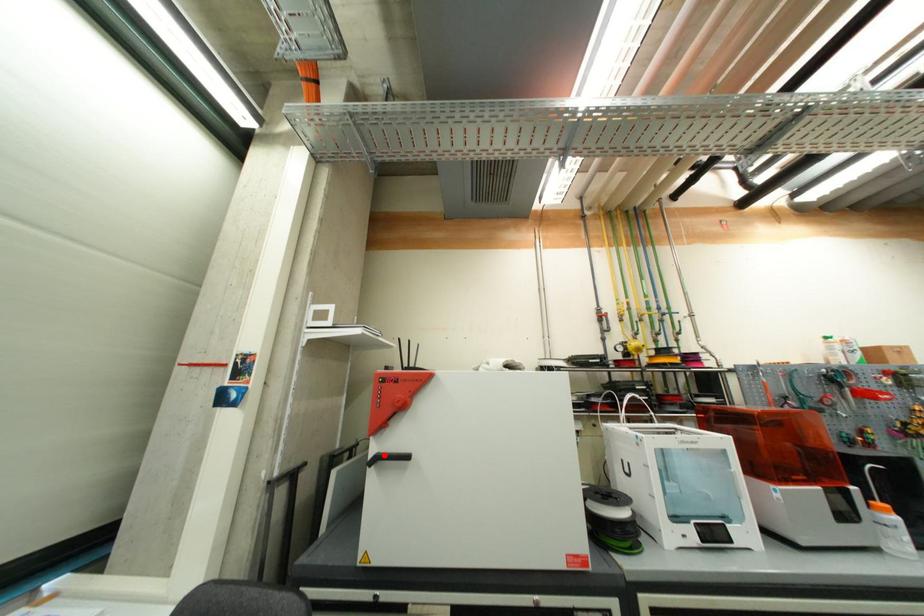
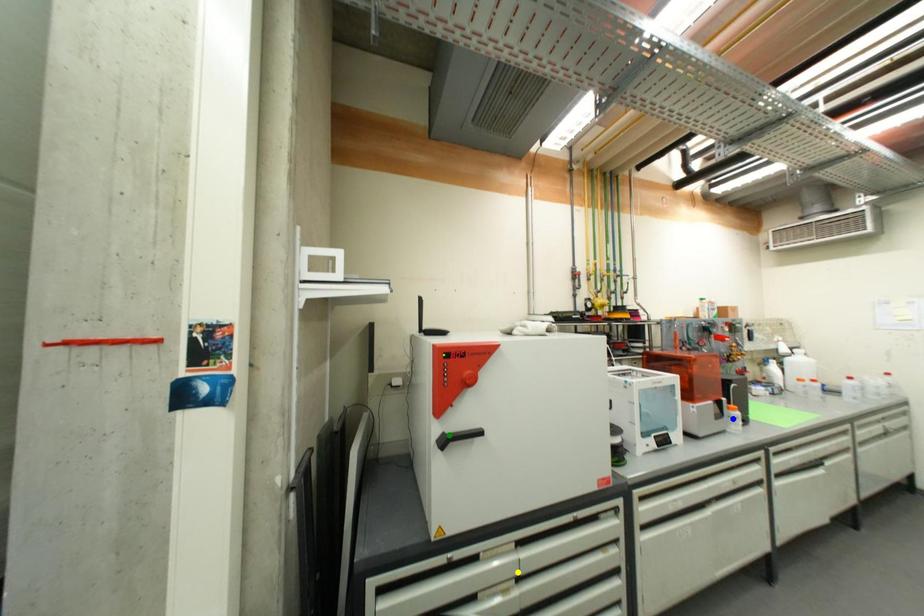
Question: I am providing you with two images of the same scene from different viewpoints. A red point is marked on the first image. You are given multiple points on the second image. Which point in image 2 is actually the same real-world point as the red point in image 1?

Choices:
 (A) yellow point
 (B) blue point
 (C) green point

Answer: (C)